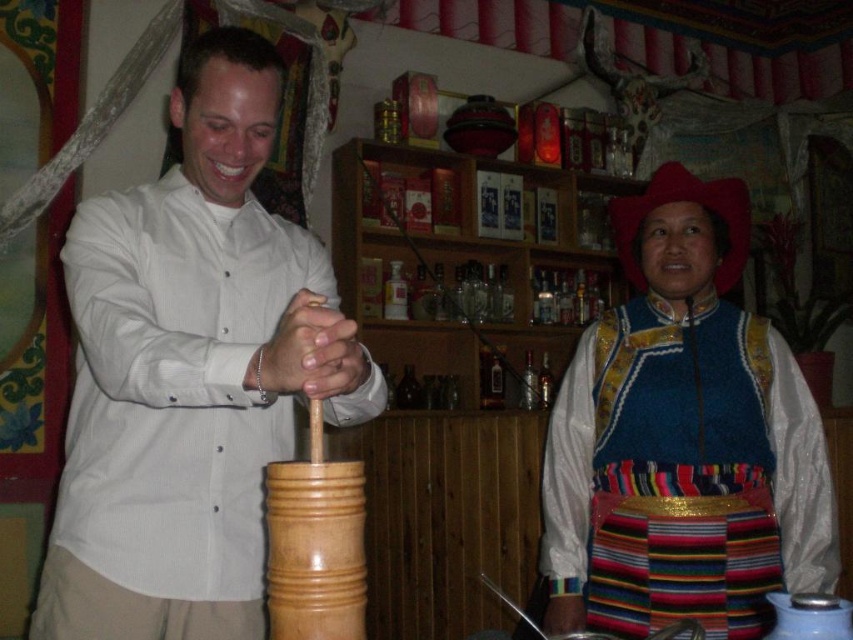
Question: Which point is closer to the camera?

Choices:
 (A) blue woven vest at center
 (B) white matte shirt at center

Answer: (B)

Question: Is white matte shirt at center further to camera compared to blue woven vest at center?

Choices:
 (A) no
 (B) yes

Answer: (A)

Question: Is white matte shirt at center to the left of blue woven vest at center from the viewer's perspective?

Choices:
 (A) no
 (B) yes

Answer: (B)

Question: Is white matte shirt at center closer to camera compared to blue woven vest at center?

Choices:
 (A) no
 (B) yes

Answer: (B)